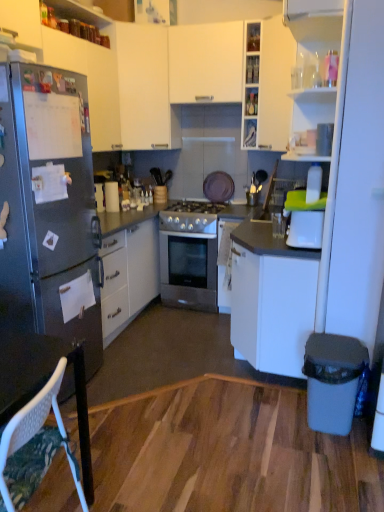
Identify the location of blank space situated above white plastic trash can at lower right (from a real-world perspective). This screenshot has height=512, width=384. (331, 339).